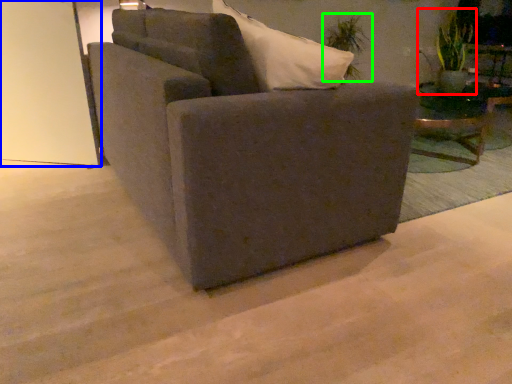
Question: Estimate the real-world distances between objects in this image. Which object is closer to plant (highlighted by a red box), glass door (highlighted by a blue box) or plant (highlighted by a green box)?

Choices:
 (A) glass door
 (B) plant

Answer: (B)